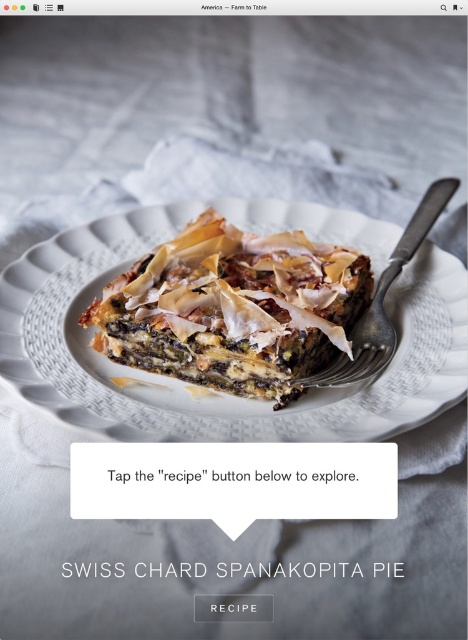
Looking at this image, you are a food critic evaluating this Swiss Chard Spanakopita Pie. You notice two points on the plate. Which point is closer to you, point (236, 337) or point (280, 481)?

Point (236, 337) is further to the viewer than point (280, 481). Wait, that doesn